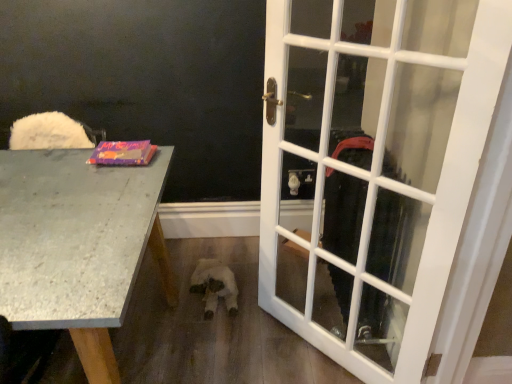
Locate an element on the screen. The image size is (512, 384). free spot to the right of white plush toy at center is located at coordinates (274, 280).